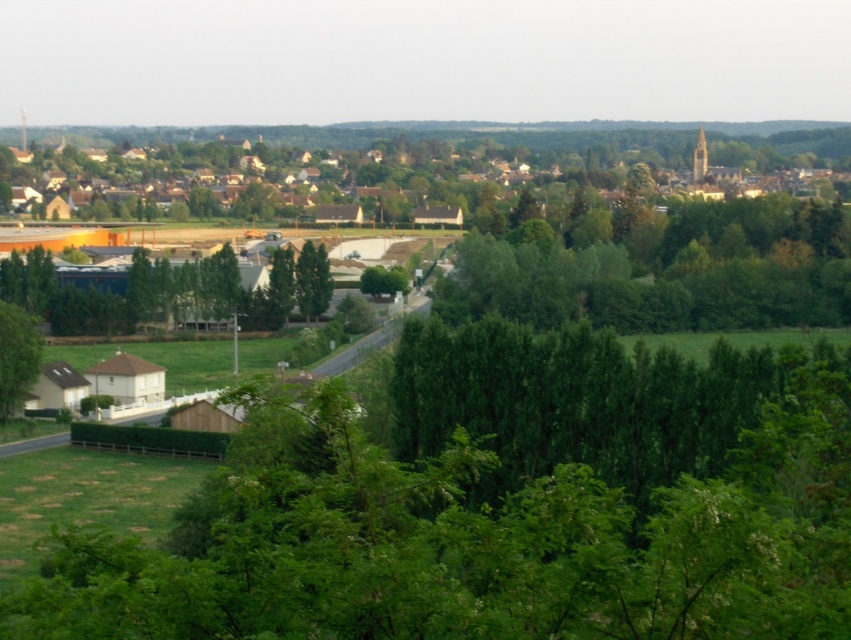
Can you confirm if green leafy trees at center is positioned to the left of green leafy tree at lower left?

No, green leafy trees at center is not to the left of green leafy tree at lower left.

Can you confirm if green leafy trees at center is taller than green leafy tree at lower left?

Correct, green leafy trees at center is much taller as green leafy tree at lower left.

Describe the element at coordinates (665, 269) in the screenshot. The image size is (851, 640). I see `green leafy trees at center` at that location.

Identify the location of green leafy trees at center. This screenshot has width=851, height=640. (665, 269).

Based on the photo, which is above, brown wooden houses at upper center or green leafy tree at center?

brown wooden houses at upper center is above.

Identify the location of brown wooden houses at upper center. (421, 150).

Describe the element at coordinates (421, 150) in the screenshot. The width and height of the screenshot is (851, 640). I see `brown wooden houses at upper center` at that location.

At what (x,y) coordinates should I click in order to perform the action: click on brown wooden houses at upper center. Please return your answer as a coordinate pair (x, y). This screenshot has height=640, width=851. Looking at the image, I should click on (421, 150).

Does green leafy tree at lower center have a lesser width compared to green leafy tree at center?

No, green leafy tree at lower center is not thinner than green leafy tree at center.

The width and height of the screenshot is (851, 640). I want to click on green leafy tree at lower center, so click(x=497, y=504).